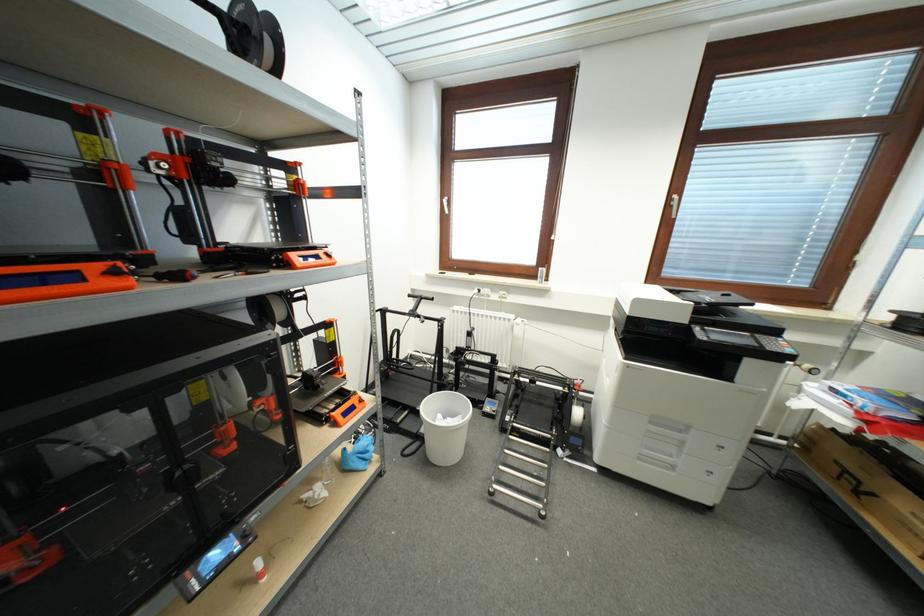
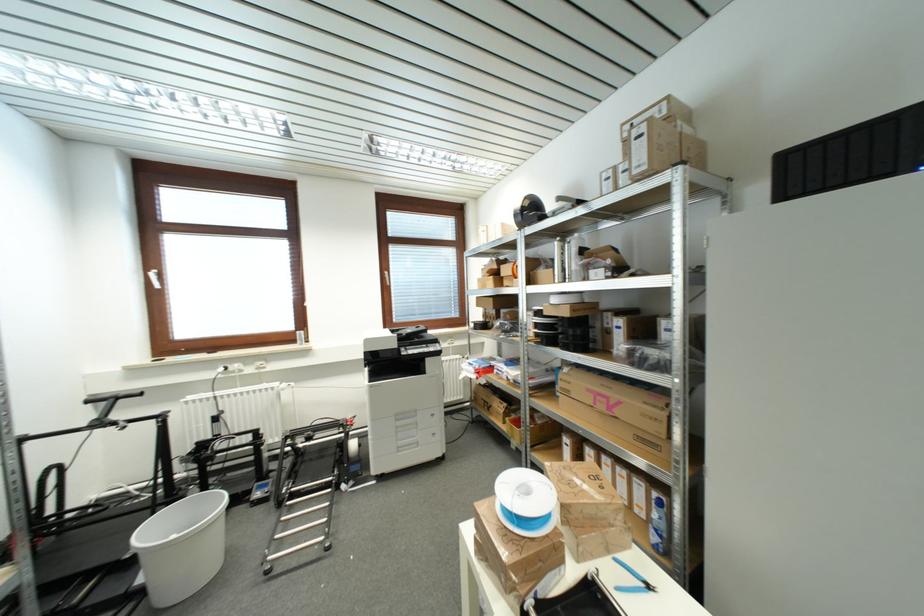
Where in the second image is the point corresponding to point (524, 374) from the first image?

(297, 438)